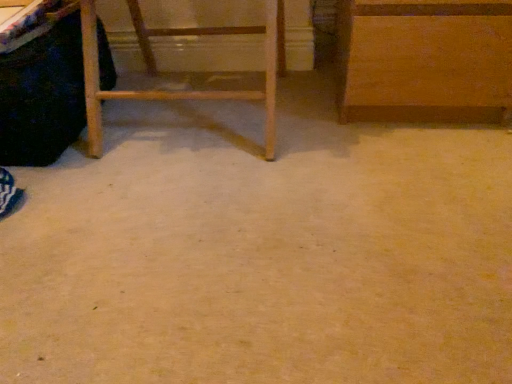
Image resolution: width=512 pixels, height=384 pixels. Identify the location of vacant space positioned to the left of wooden cabinet at upper right, arranged as the first furniture when viewed from the right. (292, 110).